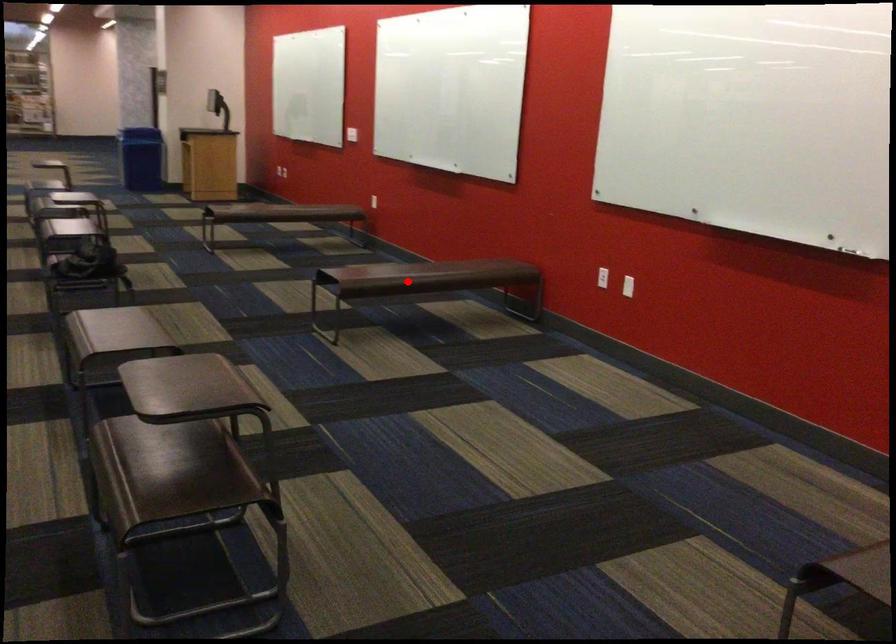
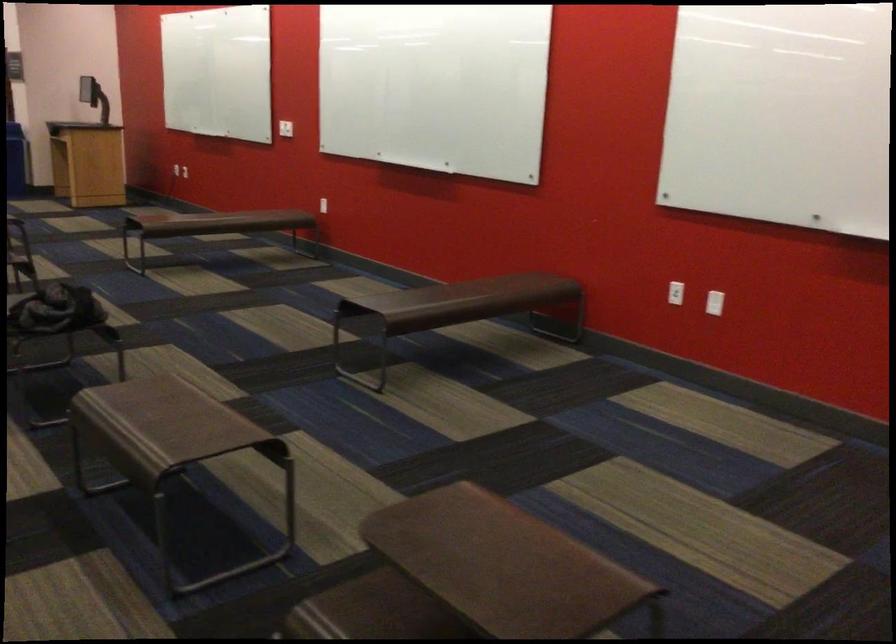
Find the pixel in the second image that matches the highlighted location in the first image.

(453, 308)